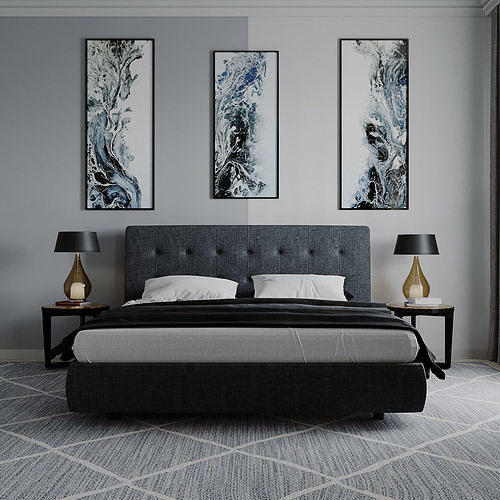
You are a GUI agent. You are given a task and a screenshot of the screen. Output one action in this format:
    pyautogui.click(x=<x>, y=<y>)
    Task: Click on the picture
    Image resolution: width=500 pixels, height=500 pixels.
    Given the screenshot: What is the action you would take?
    pyautogui.click(x=121, y=154), pyautogui.click(x=240, y=147), pyautogui.click(x=372, y=150)